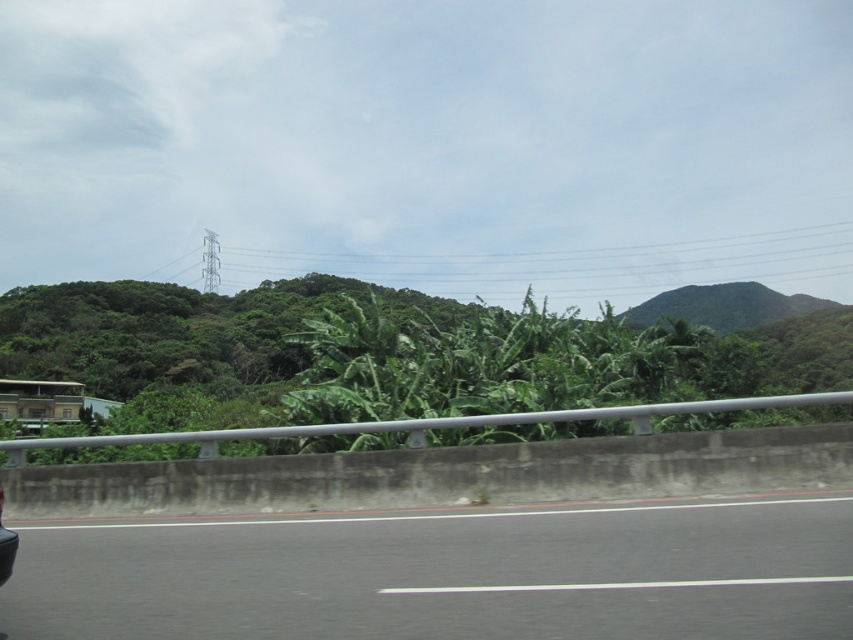
Question: Can you confirm if metallic gray power line at upper center is positioned to the left of shiny black car at lower left?

Choices:
 (A) yes
 (B) no

Answer: (B)

Question: Which point is closer to the camera?

Choices:
 (A) black asphalt highway at lower left
 (B) shiny black car at lower left
 (C) metallic gray power line at upper center

Answer: (A)

Question: Can you confirm if metallic gray power line at upper center is positioned above shiny black car at lower left?

Choices:
 (A) no
 (B) yes

Answer: (B)

Question: Considering the real-world distances, which object is closest to the green leafy vegetation at center?

Choices:
 (A) metallic gray power line at upper center
 (B) black asphalt highway at lower left
 (C) shiny black car at lower left

Answer: (A)

Question: Does black asphalt highway at lower left have a greater width compared to metallic gray power line at upper center?

Choices:
 (A) yes
 (B) no

Answer: (B)

Question: Among these objects, which one is nearest to the camera?

Choices:
 (A) shiny black car at lower left
 (B) metallic gray power line at upper center

Answer: (A)